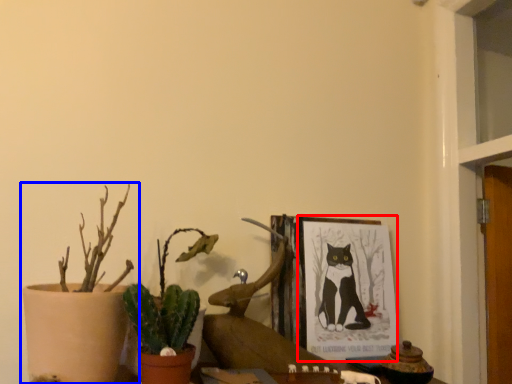
Question: Which point is further to the camera, picture frame (highlighted by a red box) or houseplant (highlighted by a blue box)?

Choices:
 (A) picture frame
 (B) houseplant

Answer: (A)